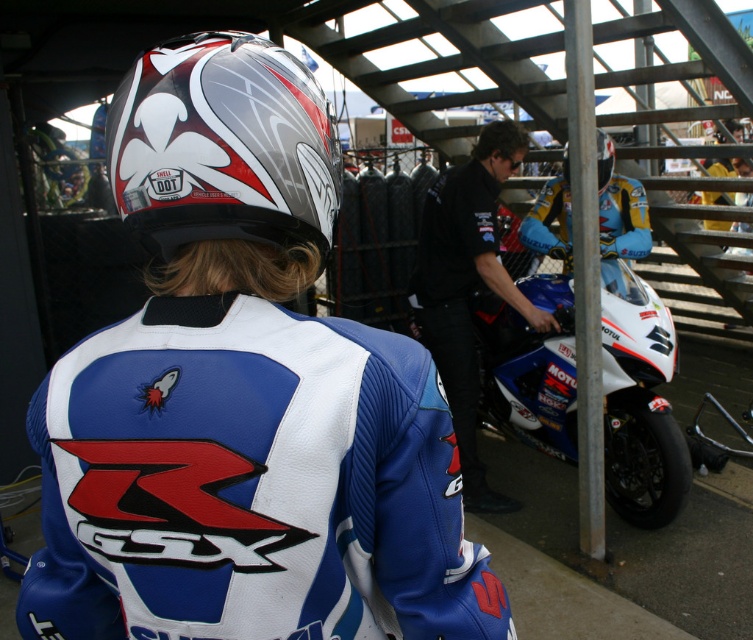
Is shiny silver helmet at upper center to the right of white glossy motorcycle at center from the viewer's perspective?

Incorrect, shiny silver helmet at upper center is not on the right side of white glossy motorcycle at center.

Which is above, shiny silver helmet at upper center or white glossy motorcycle at center?

shiny silver helmet at upper center is above.

Is point (162, 211) in front of point (651, 378)?

Yes, point (162, 211) is closer to viewer.

Find the location of a particular element. The width and height of the screenshot is (753, 640). shiny silver helmet at upper center is located at coordinates (223, 145).

Is white and blue leather jacket at center bigger than white glossy motorcycle at center?

No, white and blue leather jacket at center is not bigger than white glossy motorcycle at center.

Which is more to the right, white and blue leather jacket at center or white glossy motorcycle at center?

Positioned to the right is white glossy motorcycle at center.

This screenshot has width=753, height=640. In order to click on white and blue leather jacket at center in this screenshot , I will do `click(242, 397)`.

What do you see at coordinates (468, 285) in the screenshot? This screenshot has height=640, width=753. I see `black leather jacket at center` at bounding box center [468, 285].

Who is shorter, black leather jacket at center or glossy white helmet at upper center?

glossy white helmet at upper center is shorter.

Is point (520, 300) in front of point (599, 182)?

That is True.

At what (x,y) coordinates should I click in order to perform the action: click on black leather jacket at center. Please return your answer as a coordinate pair (x, y). This screenshot has height=640, width=753. Looking at the image, I should click on (468, 285).